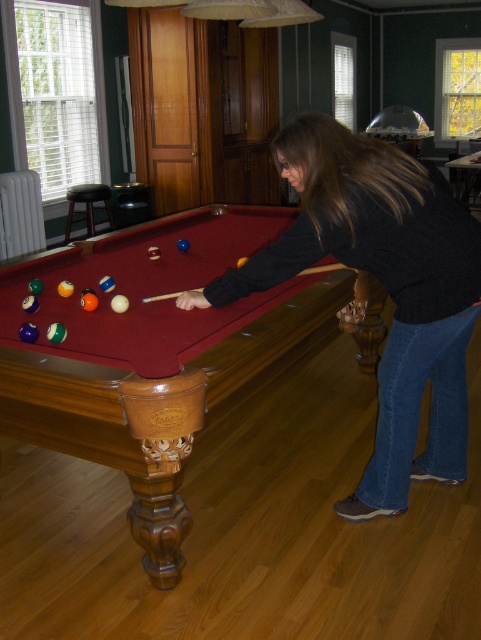
Does wooden pool table at center have a greater width compared to black sweater at center?

Correct, the width of wooden pool table at center exceeds that of black sweater at center.

Describe the element at coordinates (151, 349) in the screenshot. I see `wooden pool table at center` at that location.

At what (x,y) coordinates should I click in order to perform the action: click on wooden pool table at center. Please return your answer as a coordinate pair (x, y). The height and width of the screenshot is (640, 481). Looking at the image, I should click on (151, 349).

Is point (267, 264) closer to viewer compared to point (92, 193)?

Yes, point (267, 264) is closer to viewer.

Between black sweater at center and black leather stool at left, which one is positioned lower?

Positioned lower is black sweater at center.

Who is more distant from viewer, (405, 465) or (65, 196)?

The point (65, 196) is more distant.

Identify the location of black sweater at center. (385, 288).

Can you confirm if wooden pool table at center is positioned above black leather stool at left?

No, wooden pool table at center is not above black leather stool at left.

Where is `wooden pool table at center`? The width and height of the screenshot is (481, 640). wooden pool table at center is located at coordinates (151, 349).

Identify the location of wooden pool table at center. (151, 349).

What are the coordinates of `wooden pool table at center` in the screenshot? It's located at (151, 349).